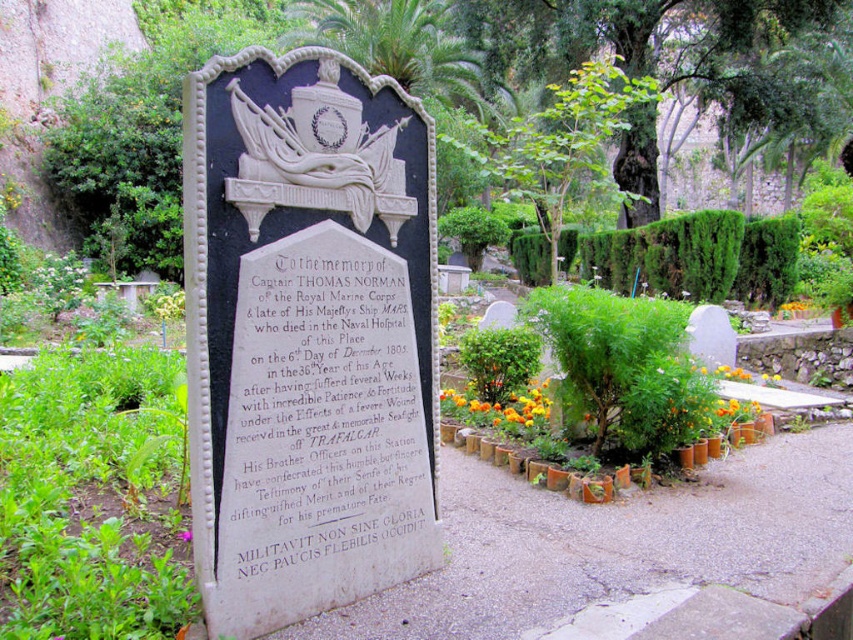
What object is located at the coordinates point (325, 419)?

The point (325, 419) corresponds to the black stone plaque at center.

You are a florist who needs to place the orange matte flower at center in front of the white marble gravestone at center. Considering their widths, will the flower block the entire gravestone from view?

The white marble gravestone at center is thinner than the orange matte flower at center, so placing the flower in front would block the entire gravestone from view since the flower is wider.